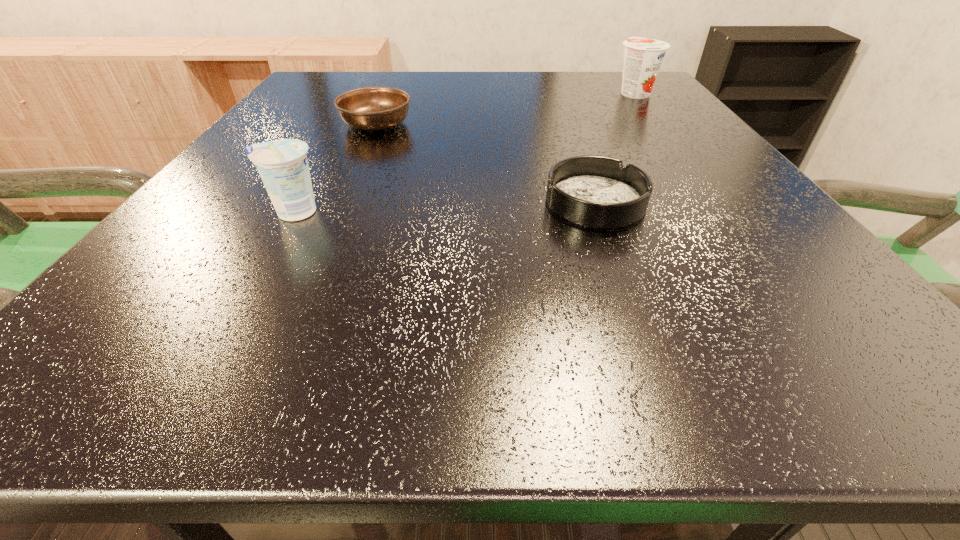
Locate an element on the screen. The width and height of the screenshot is (960, 540). free region at the far right corner is located at coordinates (599, 83).

The height and width of the screenshot is (540, 960). What are the coordinates of `blank space at the near right corner` in the screenshot? It's located at (875, 364).

At what (x,y) coordinates should I click in order to perform the action: click on free spot between the shortest object and the second shortest object. Please return your answer as a coordinate pair (x, y). Looking at the image, I should click on (486, 163).

Find the location of `free point between the ashtray and the soup bowl`. free point between the ashtray and the soup bowl is located at coordinates (486, 163).

At what (x,y) coordinates should I click in order to perform the action: click on empty space that is in between the second object from right to left and the farthest object. Please return your answer as a coordinate pair (x, y). This screenshot has height=540, width=960. Looking at the image, I should click on (614, 147).

At what (x,y) coordinates should I click in order to perform the action: click on free space between the shortest object and the left yogurt. Please return your answer as a coordinate pair (x, y). Looking at the image, I should click on (444, 207).

The image size is (960, 540). What are the coordinates of `free point between the farthest object and the third tallest object` in the screenshot? It's located at (505, 108).

At what (x,y) coordinates should I click in order to perform the action: click on free space between the left yogurt and the rightmost object. Please return your answer as a coordinate pair (x, y). Looking at the image, I should click on (464, 152).

At what (x,y) coordinates should I click in order to perform the action: click on vacant region between the right yogurt and the soup bowl. Please return your answer as a coordinate pair (x, y). This screenshot has height=540, width=960. Looking at the image, I should click on (505, 108).

The image size is (960, 540). Identify the location of vacant area between the third object from left to right and the left yogurt. click(444, 207).